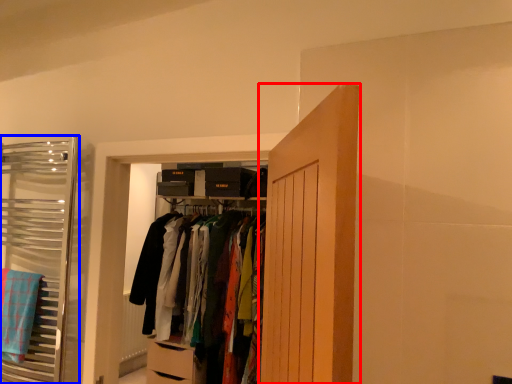
Question: Which of the following is the closest to the observer, door (highlighted by a red box) or closet (highlighted by a blue box)?

Choices:
 (A) door
 (B) closet

Answer: (A)